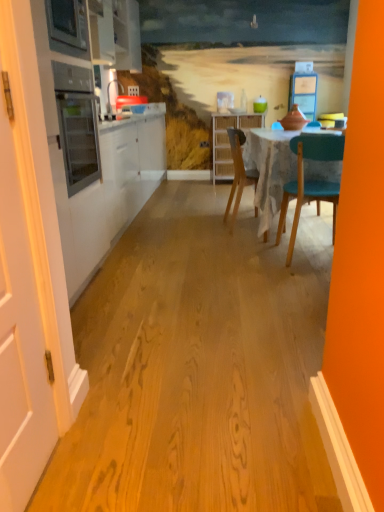
Find the location of a particular element. The image size is (384, 512). woven wood cabinet at center, which appears as the 1th cabinetry when viewed from the right is located at coordinates (228, 140).

The image size is (384, 512). Describe the element at coordinates (116, 34) in the screenshot. I see `white glossy cabinet at upper left, marked as the 2th cabinetry in a bottom-to-top arrangement` at that location.

The height and width of the screenshot is (512, 384). What do you see at coordinates (238, 173) in the screenshot?
I see `wooden chair at center` at bounding box center [238, 173].

The width and height of the screenshot is (384, 512). I want to click on woven wood cabinet at center, arranged as the 1th cabinetry when ordered from the bottom, so click(228, 140).

From a real-world perspective, is white glossy cabinet at upper left, marked as the 2th cabinetry in a bottom-to-top arrangement, positioned above or below woven wood cabinet at center, the first cabinetry positioned from the back?

white glossy cabinet at upper left, marked as the 2th cabinetry in a bottom-to-top arrangement, is situated higher than woven wood cabinet at center, the first cabinetry positioned from the back, in the real world.

What's the angular difference between white glossy cabinet at upper left, which ranks as the first cabinetry in left-to-right order, and woven wood cabinet at center, which appears as the 1th cabinetry when viewed from the right,'s facing directions?

89.4 degrees.

Which object is positioned more to the left, white glossy cabinet at upper left, which is the second cabinetry from back to front, or woven wood cabinet at center, which appears as the 1th cabinetry when viewed from the right?

Positioned to the left is white glossy cabinet at upper left, which is the second cabinetry from back to front.

Which is correct: white glossy cabinet at upper left, which ranks as the first cabinetry in left-to-right order, is inside woven wood cabinet at center, arranged as the 1th cabinetry when ordered from the bottom, or outside of it?

white glossy cabinet at upper left, which ranks as the first cabinetry in left-to-right order, is not enclosed by woven wood cabinet at center, arranged as the 1th cabinetry when ordered from the bottom.

Which of these two, white matte door at left or white glossy cabinet at upper left, the 1th cabinetry when ordered from front to back, stands taller?

Standing taller between the two is white matte door at left.

Based on the photo, is white matte door at left next to white glossy cabinet at upper left, which is the second cabinetry from back to front, and touching it?

No, white matte door at left is not next to white glossy cabinet at upper left, which is the second cabinetry from back to front.

Considering the relative positions of white matte door at left and white glossy cabinet at upper left, which is counted as the 1th cabinetry, starting from the top, in the image provided, is white matte door at left to the left or to the right of white glossy cabinet at upper left, which is counted as the 1th cabinetry, starting from the top,?

In the image, white matte door at left appears on the right side of white glossy cabinet at upper left, which is counted as the 1th cabinetry, starting from the top.

From the image's perspective, is white matte door at left located above white glossy cabinet at upper left, which is the 2th cabinetry from right to left?

Incorrect, from the image's perspective, white matte door at left is lower than white glossy cabinet at upper left, which is the 2th cabinetry from right to left.

Who is smaller, woven wood cabinet at center, placed as the 2th cabinetry when sorted from front to back, or white matte door at left?

Smaller between the two is white matte door at left.

Considering the relative positions of woven wood cabinet at center, placed as the 2th cabinetry when sorted from front to back, and white matte door at left in the image provided, is woven wood cabinet at center, placed as the 2th cabinetry when sorted from front to back, to the left of white matte door at left from the viewer's perspective?

In fact, woven wood cabinet at center, placed as the 2th cabinetry when sorted from front to back, is to the right of white matte door at left.

Is woven wood cabinet at center, placed as the 2th cabinetry when sorted from front to back, spatially inside white matte door at left, or outside of it?

The correct answer is: outside.

Is white matte door at left at the back of woven wood cabinet at center, the 2th cabinetry viewed from the left?

No, woven wood cabinet at center, the 2th cabinetry viewed from the left, is not facing away from white matte door at left.

There is a wooden chair at center. Where is `the 2nd cabinetry above it (from the image's perspective)`? the 2nd cabinetry above it (from the image's perspective) is located at coordinates (116, 34).

From the image's perspective, who appears lower, white glossy cabinet at upper left, which is counted as the 1th cabinetry, starting from the top, or wooden chair at center?

wooden chair at center appears lower in the image.

Considering the sizes of white glossy cabinet at upper left, which is the 2th cabinetry from right to left, and wooden chair at center in the image, is white glossy cabinet at upper left, which is the 2th cabinetry from right to left, bigger or smaller than wooden chair at center?

Clearly, white glossy cabinet at upper left, which is the 2th cabinetry from right to left, is larger in size than wooden chair at center.

How different are the orientations of white glossy cabinet at upper left, which is the second cabinetry from back to front, and wooden chair at center in degrees?

The facing directions of white glossy cabinet at upper left, which is the second cabinetry from back to front, and wooden chair at center are 0.372 degrees apart.

Which point is more forward, (7, 141) or (241, 186)?

The point (7, 141) is in front.

Is white matte door at left to the left or to the right of wooden chair at center in the image?

Clearly, white matte door at left is on the left of wooden chair at center in the image.

In the scene shown: Does white matte door at left have a larger size compared to wooden chair at center?

No.

Which of these two, white matte door at left or wooden chair at center, stands taller?

white matte door at left is taller.

Is wooden chair at center shorter than white glossy cabinet at upper left, marked as the 2th cabinetry in a bottom-to-top arrangement?

No.

Where is `chair on the right side of white glossy cabinet at upper left, the 1th cabinetry when ordered from front to back`? The width and height of the screenshot is (384, 512). chair on the right side of white glossy cabinet at upper left, the 1th cabinetry when ordered from front to back is located at coordinates (238, 173).

Considering the positions of objects wooden chair at center and white glossy cabinet at upper left, which is the 2th cabinetry from right to left, in the image provided, who is more to the left, wooden chair at center or white glossy cabinet at upper left, which is the 2th cabinetry from right to left,?

white glossy cabinet at upper left, which is the 2th cabinetry from right to left.

From the image's perspective, is wooden chair at center positioned above or below white matte door at left?

wooden chair at center is situated higher than white matte door at left in the image.

Considering the relative sizes of wooden chair at center and white matte door at left in the image provided, is wooden chair at center wider than white matte door at left?

Yes.

Does point (234, 161) lie behind point (2, 359)?

Yes, point (234, 161) is farther from viewer.

Are wooden chair at center and white matte door at left located far from each other?

wooden chair at center is far away from white matte door at left.

Locate an element on the screen. The height and width of the screenshot is (512, 384). cabinetry behind the white glossy cabinet at upper left, which is the second cabinetry from back to front is located at coordinates (x=228, y=140).

At what (x,y) coordinates should I click in order to perform the action: click on door in front of the white glossy cabinet at upper left, which is the 2th cabinetry from right to left. Please return your answer as a coordinate pair (x, y). This screenshot has width=384, height=512. Looking at the image, I should click on (19, 302).

Considering their positions, is woven wood cabinet at center, placed as the 2th cabinetry when sorted from front to back, positioned closer to white matte door at left than wooden chair at center?

wooden chair at center is positioned closer to the anchor white matte door at left.

Which object lies further to the anchor point woven wood cabinet at center, the 2th cabinetry viewed from the left, white matte door at left or wooden chair at center?

white matte door at left is further to woven wood cabinet at center, the 2th cabinetry viewed from the left.

Estimate the real-world distances between objects in this image. Which object is further from white glossy cabinet at upper left, marked as the 2th cabinetry in a bottom-to-top arrangement, wooden chair at center or woven wood cabinet at center, marked as the second cabinetry in a top-to-bottom arrangement?

Among the two, woven wood cabinet at center, marked as the second cabinetry in a top-to-bottom arrangement, is located further to white glossy cabinet at upper left, marked as the 2th cabinetry in a bottom-to-top arrangement.

Looking at this image, which object lies further to the anchor point woven wood cabinet at center, marked as the second cabinetry in a top-to-bottom arrangement, white matte door at left or white glossy cabinet at upper left, which is the 2th cabinetry from right to left?

white matte door at left is positioned further to the anchor woven wood cabinet at center, marked as the second cabinetry in a top-to-bottom arrangement.

Based on their spatial positions, is white glossy cabinet at upper left, which is counted as the 1th cabinetry, starting from the top, or woven wood cabinet at center, placed as the 2th cabinetry when sorted from front to back, closer to white matte door at left?

white glossy cabinet at upper left, which is counted as the 1th cabinetry, starting from the top, is positioned closer to the anchor white matte door at left.

Looking at the image, which one is located further to white glossy cabinet at upper left, marked as the 2th cabinetry in a bottom-to-top arrangement, woven wood cabinet at center, which appears as the 1th cabinetry when viewed from the right, or wooden chair at center?

Based on the image, woven wood cabinet at center, which appears as the 1th cabinetry when viewed from the right, appears to be further to white glossy cabinet at upper left, marked as the 2th cabinetry in a bottom-to-top arrangement.

Looking at the image, which one is located further to wooden chair at center, woven wood cabinet at center, marked as the second cabinetry in a top-to-bottom arrangement, or white glossy cabinet at upper left, the 1th cabinetry when ordered from front to back?

The object further to wooden chair at center is white glossy cabinet at upper left, the 1th cabinetry when ordered from front to back.

From the image, which object appears to be farther from wooden chair at center, white matte door at left or woven wood cabinet at center, the first cabinetry positioned from the back?

The object further to wooden chair at center is white matte door at left.

Locate an element on the screen. chair located between white matte door at left and woven wood cabinet at center, which appears as the 1th cabinetry when viewed from the right, in the depth direction is located at coordinates (238, 173).

Find the location of a particular element. cabinetry between white matte door at left and wooden chair at center along the z-axis is located at coordinates (116, 34).

Where is `chair positioned between white glossy cabinet at upper left, marked as the 2th cabinetry in a bottom-to-top arrangement, and woven wood cabinet at center, arranged as the 1th cabinetry when ordered from the bottom, from near to far`? chair positioned between white glossy cabinet at upper left, marked as the 2th cabinetry in a bottom-to-top arrangement, and woven wood cabinet at center, arranged as the 1th cabinetry when ordered from the bottom, from near to far is located at coordinates point(238,173).

This screenshot has width=384, height=512. I want to click on cabinetry between white matte door at left and woven wood cabinet at center, the first cabinetry positioned from the back, from front to back, so click(x=116, y=34).